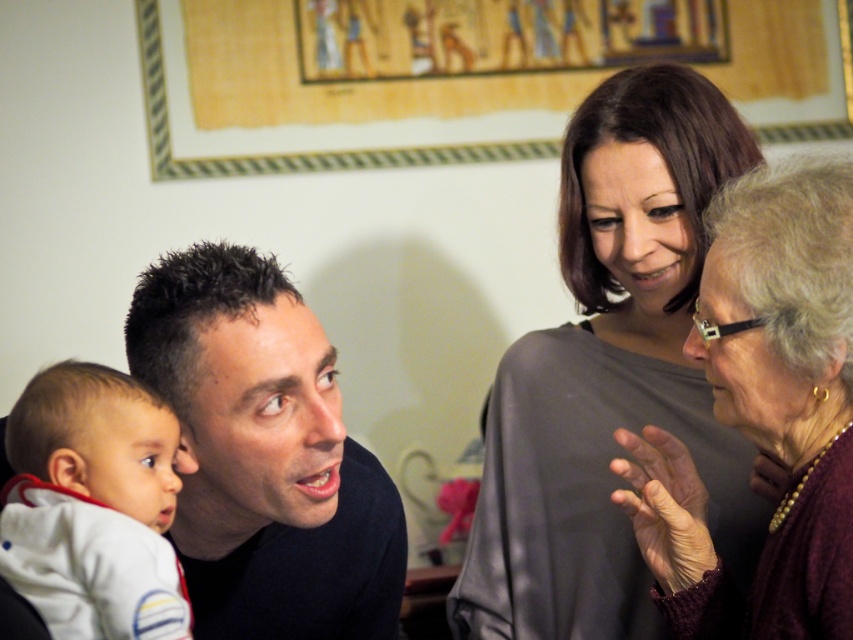
Question: Is dark blue shirt at left thinner than white soft fabric baby at lower left?

Choices:
 (A) yes
 (B) no

Answer: (B)

Question: Which point is closer to the camera taking this photo?

Choices:
 (A) (224, 477)
 (B) (73, 548)
 (C) (782, 458)
 (D) (567, 259)

Answer: (B)

Question: Observing the image, what is the correct spatial positioning of dark blue shirt at left in reference to white soft fabric baby at lower left?

Choices:
 (A) above
 (B) below

Answer: (B)

Question: Estimate the real-world distances between objects in this image. Which object is farther from the dark blue shirt at left?

Choices:
 (A) maroon textured sweater at upper right
 (B) smooth gray blouse at upper right

Answer: (A)

Question: Which point is closer to the camera?

Choices:
 (A) (252, 296)
 (B) (659, 163)
 (C) (155, 426)
 (D) (756, 605)

Answer: (C)

Question: Does smooth gray blouse at upper right have a lesser width compared to white soft fabric baby at lower left?

Choices:
 (A) yes
 (B) no

Answer: (B)